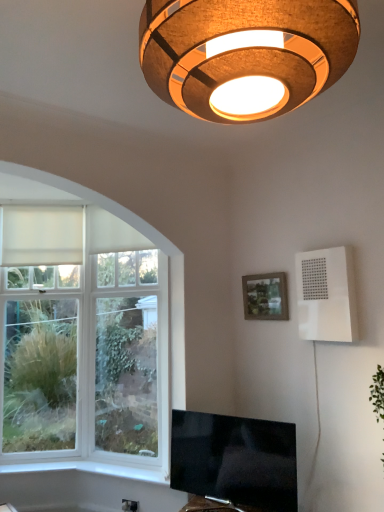
What do you see at coordinates (91, 470) in the screenshot? This screenshot has width=384, height=512. I see `white smooth window sill at lower left` at bounding box center [91, 470].

What is the approximate width of white smooth window sill at lower left?

7.80 inches.

This screenshot has width=384, height=512. Find the location of `matte wooden picture frame at upper right`. matte wooden picture frame at upper right is located at coordinates (265, 296).

This screenshot has width=384, height=512. Describe the element at coordinates (326, 295) in the screenshot. I see `white plastic speaker at upper right` at that location.

Locate an element on the screen. flat-screen tv at lower center is located at coordinates (233, 463).

The width and height of the screenshot is (384, 512). Describe the element at coordinates (41, 234) in the screenshot. I see `white matte curtain at left` at that location.

Describe the element at coordinates (245, 54) in the screenshot. I see `matte brown lampshade at upper center` at that location.

Locate an element on the screen. Image resolution: width=384 pixels, height=512 pixels. white plastic electric outlet at lower center is located at coordinates (129, 505).

Is white smooth window sill at lower left next to flat-screen tv at lower center and touching it?

white smooth window sill at lower left and flat-screen tv at lower center are not in contact.

Which of these two, white smooth window sill at lower left or flat-screen tv at lower center, stands shorter?

white smooth window sill at lower left is shorter.

From the image's perspective, between white smooth window sill at lower left and flat-screen tv at lower center, which one is located above?

flat-screen tv at lower center, from the image's perspective.

Is matte brown lampshade at upper center turned away from white plastic electric outlet at lower center?

No, white plastic electric outlet at lower center is not at the back of matte brown lampshade at upper center.

Does matte brown lampshade at upper center have a lesser height compared to white plastic electric outlet at lower center?

No, matte brown lampshade at upper center is not shorter than white plastic electric outlet at lower center.

In the image, there is a white plastic electric outlet at lower center. Identify the location of lamp above it (from the image's perspective). [245, 54].

Does matte brown lampshade at upper center contain white plastic electric outlet at lower center?

No.

How different are the orientations of white matte curtain at left and white plastic speaker at upper right in degrees?

They differ by 60.3 degrees in their facing directions.

Does white matte curtain at left appear on the right side of white plastic speaker at upper right?

No, white matte curtain at left is not to the right of white plastic speaker at upper right.

Is white matte curtain at left situated inside white plastic speaker at upper right or outside?

white matte curtain at left exists outside the volume of white plastic speaker at upper right.

In the image, is white matte curtain at left positioned in front of or behind white plastic speaker at upper right?

white matte curtain at left is positioned farther from the viewer than white plastic speaker at upper right.

Is white matte curtain at left next to matte brown lampshade at upper center and touching it?

No, white matte curtain at left is not in contact with matte brown lampshade at upper center.

In the image, is white matte curtain at left positioned in front of or behind matte brown lampshade at upper center?

white matte curtain at left is positioned farther from the viewer than matte brown lampshade at upper center.

Considering the sizes of objects white matte curtain at left and matte brown lampshade at upper center in the image provided, who is shorter, white matte curtain at left or matte brown lampshade at upper center?

matte brown lampshade at upper center.

From a real-world perspective, is white plastic electric outlet at lower center over flat-screen tv at lower center?

Incorrect, from a real-world perspective, white plastic electric outlet at lower center is lower than flat-screen tv at lower center.

Is white plastic electric outlet at lower center positioned far away from flat-screen tv at lower center?

white plastic electric outlet at lower center is actually quite close to flat-screen tv at lower center.

Is white plastic electric outlet at lower center behind flat-screen tv at lower center?

Yes, white plastic electric outlet at lower center is further from the viewer.

From the image's perspective, is white plastic speaker at upper right positioned above or below white smooth window sill at lower left?

From the image's perspective, white plastic speaker at upper right appears above white smooth window sill at lower left.

Is white plastic speaker at upper right bigger than white smooth window sill at lower left?

Indeed, white plastic speaker at upper right has a larger size compared to white smooth window sill at lower left.

How different are the orientations of white plastic speaker at upper right and white smooth window sill at lower left in degrees?

They differ by 28.2 degrees in their facing directions.

Is white matte curtain at left to the left of white smooth window sill at lower left from the viewer's perspective?

Indeed, white matte curtain at left is positioned on the left side of white smooth window sill at lower left.

Does white matte curtain at left have a larger size compared to white smooth window sill at lower left?

Yes, white matte curtain at left is bigger than white smooth window sill at lower left.

Is white smooth window sill at lower left at the back of white matte curtain at left?

No.

Identify the location of window sill located underneath the white matte curtain at left (from a real-world perspective). (91, 470).

Image resolution: width=384 pixels, height=512 pixels. Identify the location of television to the right of white smooth window sill at lower left. (233, 463).

Identify the location of electric outlet that is below the matte brown lampshade at upper center (from the image's perspective). This screenshot has width=384, height=512. (129, 505).

Considering their positions, is matte brown lampshade at upper center positioned further to white plastic electric outlet at lower center than matte wooden picture frame at upper right?

Among the two, matte brown lampshade at upper center is located further to white plastic electric outlet at lower center.

Estimate the real-world distances between objects in this image. Which object is closer to white plastic speaker at upper right, white plastic electric outlet at lower center or matte brown lampshade at upper center?

white plastic electric outlet at lower center is positioned closer to the anchor white plastic speaker at upper right.

When comparing their distances from flat-screen tv at lower center, does white plastic speaker at upper right or white matte curtain at left seem further?

Among the two, white matte curtain at left is located further to flat-screen tv at lower center.

Looking at the image, which one is located further to white plastic speaker at upper right, white smooth window sill at lower left or flat-screen tv at lower center?

Among the two, white smooth window sill at lower left is located further to white plastic speaker at upper right.

From the image, which object appears to be farther from flat-screen tv at lower center, white matte curtain at left or white plastic electric outlet at lower center?

The object further to flat-screen tv at lower center is white matte curtain at left.

Based on their spatial positions, is white plastic speaker at upper right or matte wooden picture frame at upper right closer to white plastic electric outlet at lower center?

Based on the image, matte wooden picture frame at upper right appears to be nearer to white plastic electric outlet at lower center.

Considering their positions, is white plastic speaker at upper right positioned closer to white smooth window sill at lower left than flat-screen tv at lower center?

flat-screen tv at lower center is positioned closer to the anchor white smooth window sill at lower left.

Based on their spatial positions, is white matte curtain at left or matte wooden picture frame at upper right further from flat-screen tv at lower center?

Based on the image, white matte curtain at left appears to be further to flat-screen tv at lower center.

You are a GUI agent. You are given a task and a screenshot of the screen. Output one action in this format:
    pyautogui.click(x=<x>, y=<y>)
    Task: Click on the television between matte brown lampshade at upper center and white smooth window sill at lower left in the front-back direction
    The width and height of the screenshot is (384, 512).
    Given the screenshot: What is the action you would take?
    pyautogui.click(x=233, y=463)

You are a GUI agent. You are given a task and a screenshot of the screen. Output one action in this format:
    pyautogui.click(x=<x>, y=<y>)
    Task: Click on the window sill between matte brown lampshade at upper center and white matte curtain at left along the z-axis
    The image size is (384, 512).
    Given the screenshot: What is the action you would take?
    pyautogui.click(x=91, y=470)

The image size is (384, 512). Find the location of `window sill between matte brown lampshade at upper center and white plastic electric outlet at lower center along the z-axis`. window sill between matte brown lampshade at upper center and white plastic electric outlet at lower center along the z-axis is located at coordinates (91, 470).

Identify the location of electric outlet between white matte curtain at left and white plastic speaker at upper right. The height and width of the screenshot is (512, 384). (129, 505).